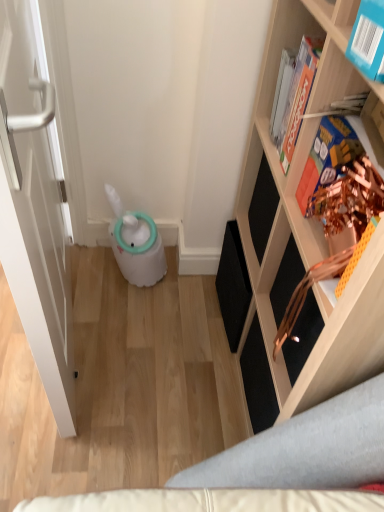
Find the location of a particular element. The image size is (384, 512). free spot below white matte door at left (from a real-world perspective) is located at coordinates (79, 322).